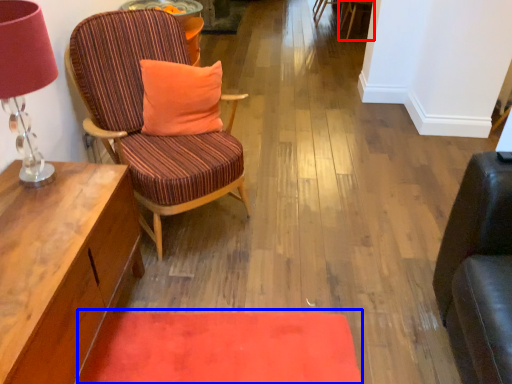
Question: Which object is further to the camera taking this photo, chair (highlighted by a red box) or mat (highlighted by a blue box)?

Choices:
 (A) chair
 (B) mat

Answer: (A)